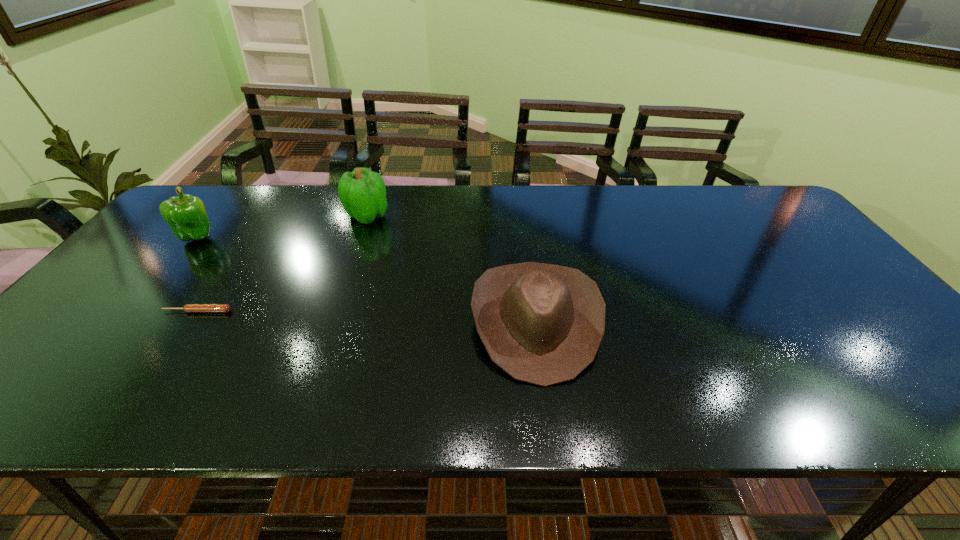
Where is `object that is at the far edge`? object that is at the far edge is located at coordinates (362, 192).

In order to click on object that is at the near edge in this screenshot , I will do `click(542, 324)`.

Find the location of a particular element. object located in the left edge section of the desktop is located at coordinates (186, 215).

Where is `vacant space at the far edge`? The height and width of the screenshot is (540, 960). vacant space at the far edge is located at coordinates (709, 215).

Find the location of `vacant space at the near edge of the desktop`. vacant space at the near edge of the desktop is located at coordinates (266, 399).

You are a GUI agent. You are given a task and a screenshot of the screen. Output one action in this format:
    pyautogui.click(x=<x>, y=<y>)
    Task: Click on the vacant space at the left edge of the desktop
    Image resolution: width=960 pixels, height=540 pixels.
    Given the screenshot: What is the action you would take?
    pyautogui.click(x=87, y=333)

Locate an element on the screen. The width and height of the screenshot is (960, 540). vacant space at the right edge is located at coordinates (840, 333).

Locate an element on the screen. This screenshot has width=960, height=540. vacant space at the far right corner is located at coordinates (783, 211).

This screenshot has height=540, width=960. I want to click on free space between the shortest object and the third tallest object, so click(367, 316).

Find the location of `unoccupied position between the left bell pepper and the rightmost object`. unoccupied position between the left bell pepper and the rightmost object is located at coordinates (367, 279).